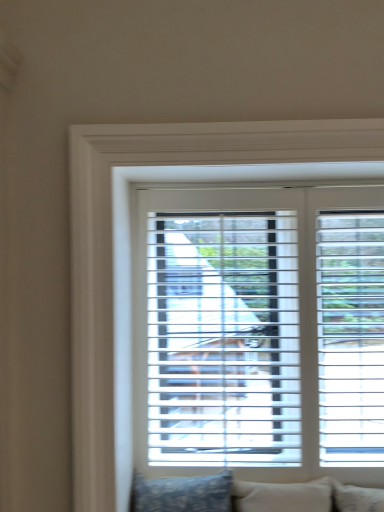
Question: Could you tell me if beige fabric pillow at lower center, which is the 1th pillow from right to left, is facing white plastic blinds at center?

Choices:
 (A) yes
 (B) no

Answer: (B)

Question: Considering the relative positions of beige fabric pillow at lower center, which is the 1th pillow from right to left, and white plastic blinds at center in the image provided, is beige fabric pillow at lower center, which is the 1th pillow from right to left, to the right of white plastic blinds at center from the viewer's perspective?

Choices:
 (A) no
 (B) yes

Answer: (B)

Question: From the image's perspective, does beige fabric pillow at lower center, acting as the second pillow starting from the left, appear lower than white plastic blinds at center?

Choices:
 (A) yes
 (B) no

Answer: (A)

Question: Is beige fabric pillow at lower center, which is the 1th pillow from right to left, closer to camera compared to white plastic blinds at center?

Choices:
 (A) yes
 (B) no

Answer: (A)

Question: From a real-world perspective, does beige fabric pillow at lower center, acting as the second pillow starting from the left, sit lower than white plastic blinds at center?

Choices:
 (A) yes
 (B) no

Answer: (A)

Question: Does beige fabric pillow at lower center, which is the 1th pillow from right to left, have a greater height compared to white plastic blinds at center?

Choices:
 (A) yes
 (B) no

Answer: (B)

Question: Does beige fabric pillow at lower center, acting as the second pillow starting from the left, lie in front of blue patterned pillow at lower center, which ranks as the second pillow in right-to-left order?

Choices:
 (A) yes
 (B) no

Answer: (B)

Question: Is blue patterned pillow at lower center, which ranks as the second pillow in right-to-left order, inside beige fabric pillow at lower center, acting as the second pillow starting from the left?

Choices:
 (A) yes
 (B) no

Answer: (B)

Question: From the image's perspective, does beige fabric pillow at lower center, which is the 1th pillow from right to left, appear lower than blue patterned pillow at lower center, which ranks as the second pillow in right-to-left order?

Choices:
 (A) yes
 (B) no

Answer: (A)

Question: Is beige fabric pillow at lower center, acting as the second pillow starting from the left, touching blue patterned pillow at lower center, which ranks as the second pillow in right-to-left order?

Choices:
 (A) no
 (B) yes

Answer: (A)

Question: Can you confirm if beige fabric pillow at lower center, which is the 1th pillow from right to left, is bigger than blue patterned pillow at lower center, which ranks as the second pillow in right-to-left order?

Choices:
 (A) no
 (B) yes

Answer: (A)

Question: Is beige fabric pillow at lower center, which is the 1th pillow from right to left, facing towards blue patterned pillow at lower center, arranged as the 1th pillow when viewed from the left?

Choices:
 (A) yes
 (B) no

Answer: (B)

Question: From the image's perspective, is white plastic blinds at center on top of beige fabric pillow at lower center, acting as the second pillow starting from the left?

Choices:
 (A) yes
 (B) no

Answer: (A)